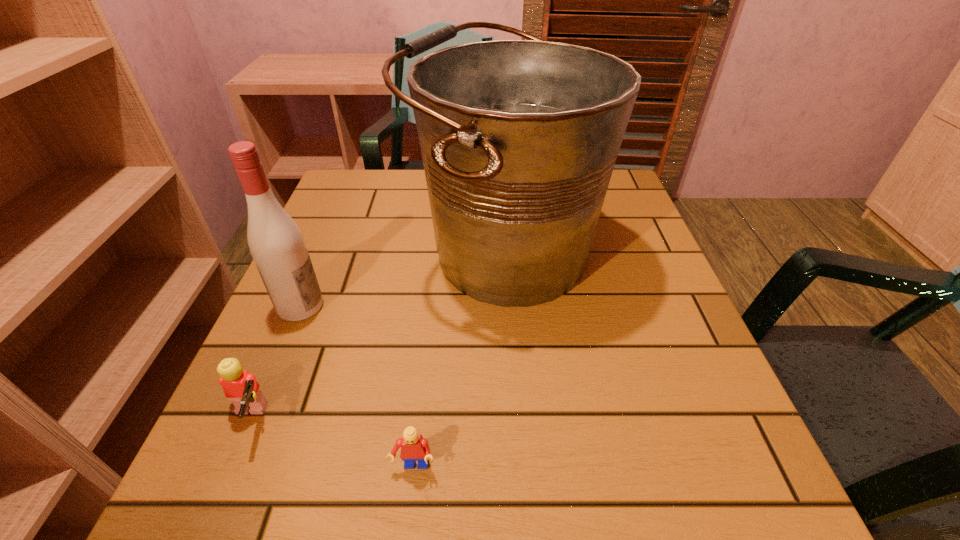
Locate an element on the screen. unoccupied position between the bucket and the alcohol is located at coordinates (402, 279).

Locate an element on the screen. free spot between the second shortest object and the third shortest object is located at coordinates (275, 363).

I want to click on free spot between the second nearest object and the alcohol, so click(275, 363).

Select which object is the second closest to the bucket. Please provide its 2D coordinates. Your answer should be formatted as a tuple, i.e. [(x, y)], where the tuple contains the x and y coordinates of a point satisfying the conditions above.

[(240, 386)]

Locate which object is the second closest to the taller Lego. Please provide its 2D coordinates. Your answer should be formatted as a tuple, i.e. [(x, y)], where the tuple contains the x and y coordinates of a point satisfying the conditions above.

[(414, 447)]

Locate an element on the screen. Image resolution: width=960 pixels, height=540 pixels. vacant space that satisfies the following two spatial constraints: 1. on the front side of the bucket; 2. in front of the left Lego with the accessory visible is located at coordinates (516, 420).

Image resolution: width=960 pixels, height=540 pixels. Identify the location of free space that satisfies the following two spatial constraints: 1. on the front side of the bucket; 2. on the label of the alcohol. (509, 306).